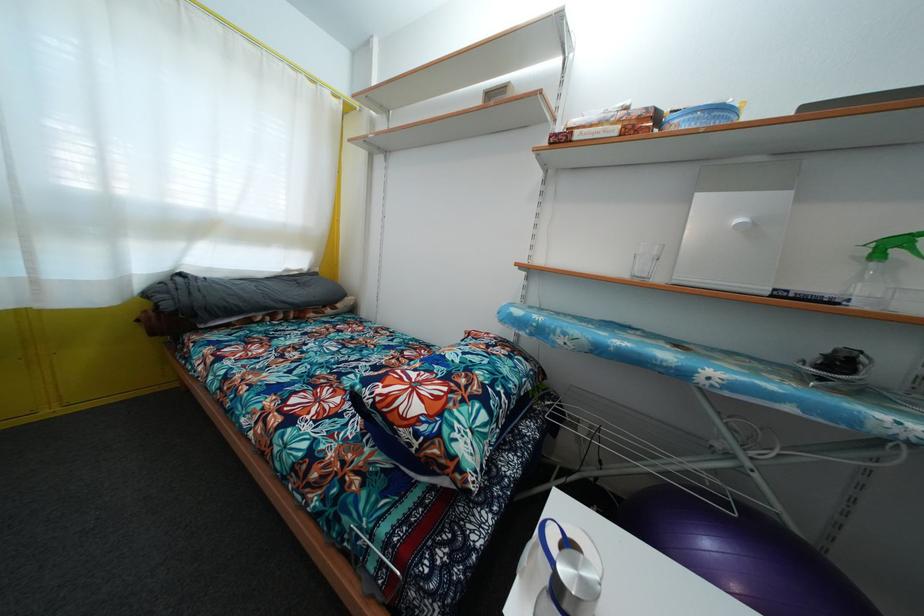
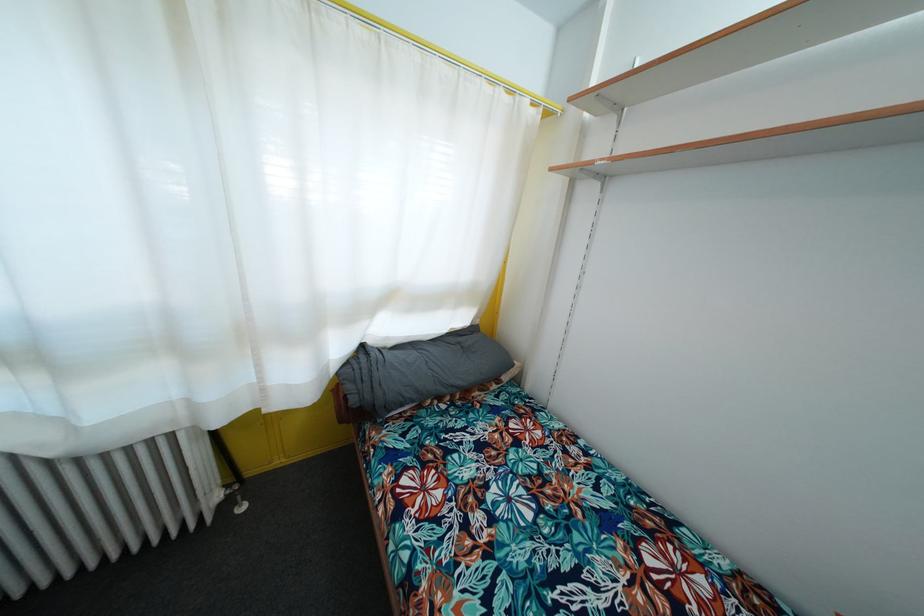
What movement of the cameraman would produce the second image?

The cameraman walked toward left, forward.